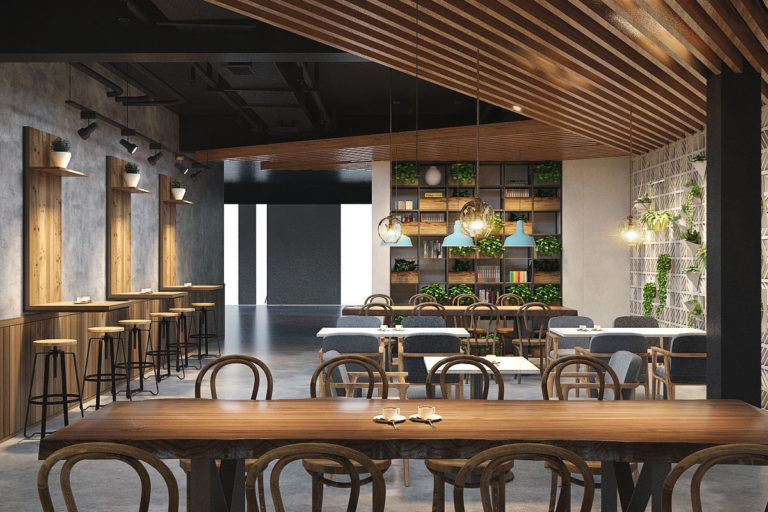
The height and width of the screenshot is (512, 768). I want to click on stool top, so click(x=61, y=344), click(x=117, y=330), click(x=136, y=325), click(x=167, y=314), click(x=187, y=309), click(x=207, y=303).